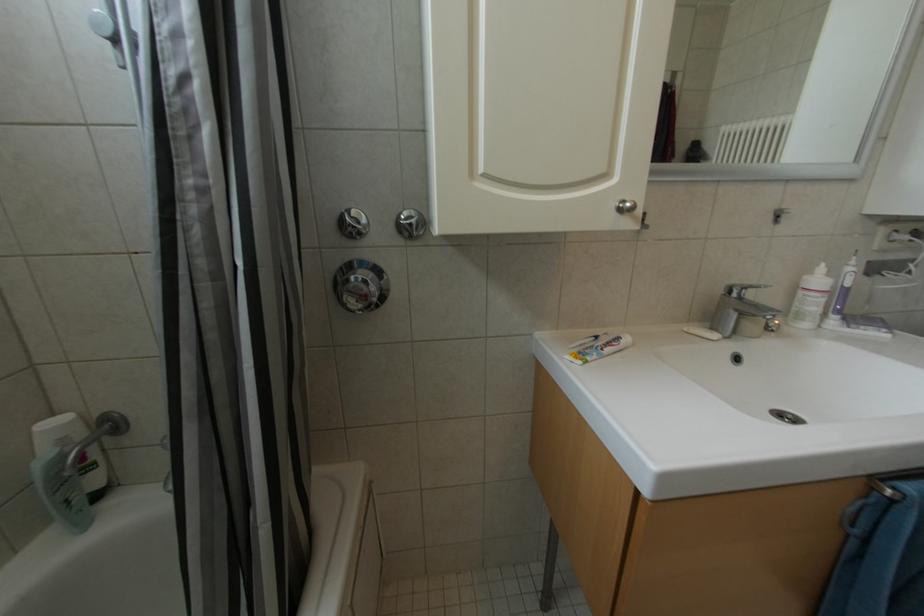
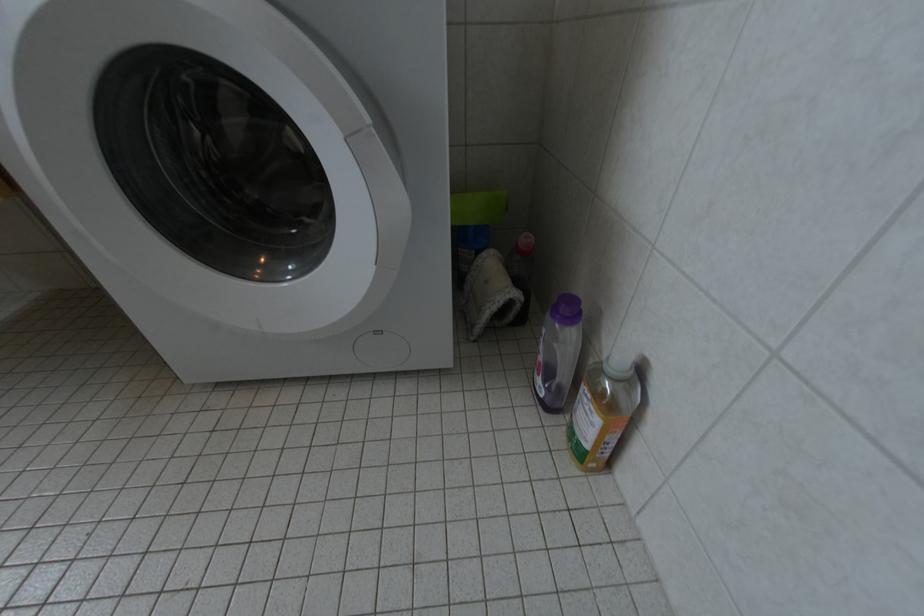
Question: In a continuous first-person perspective shot, in which direction is the camera moving?

Choices:
 (A) Left
 (B) Right
 (C) Forward
 (D) Backward

Answer: (B)